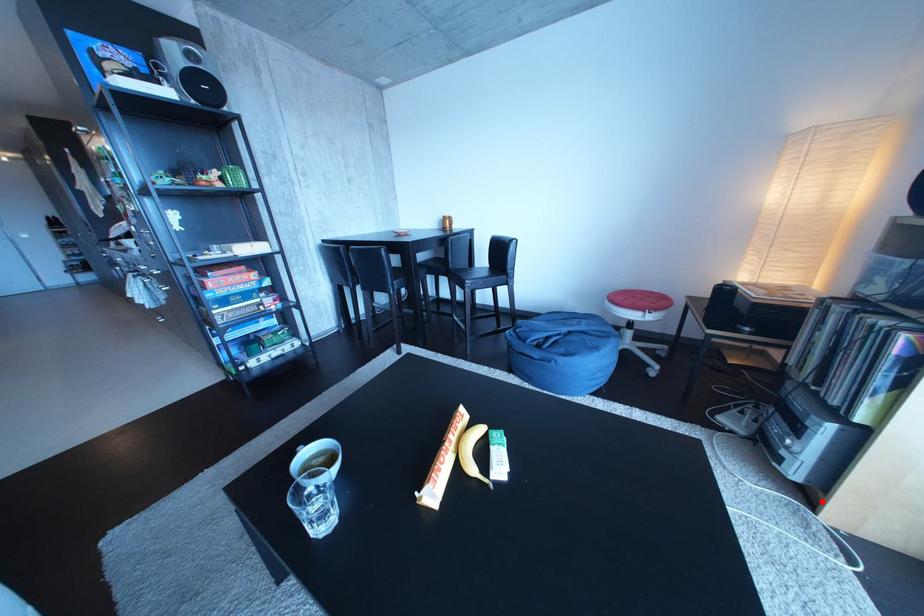
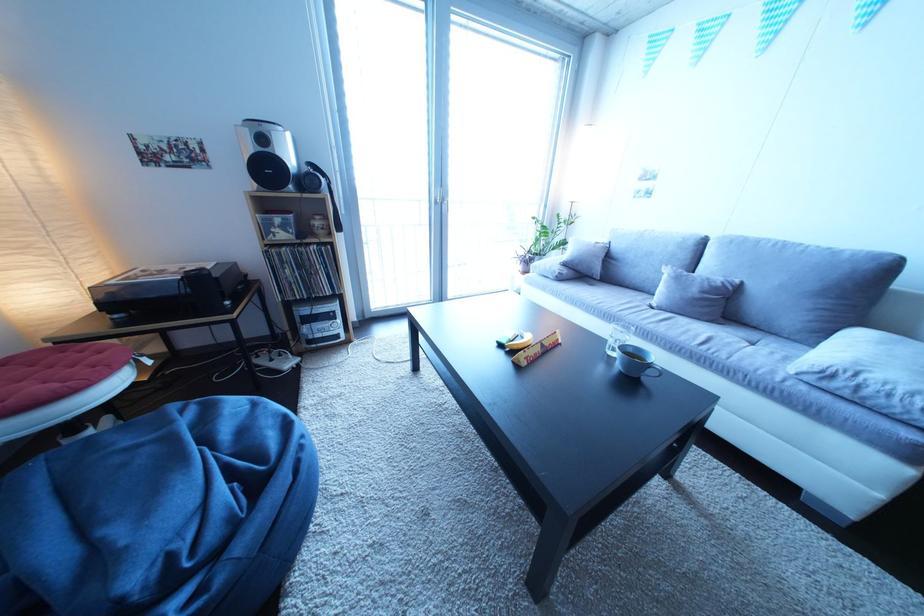
Question: I am providing you with two images of the same scene from different viewpoints. A red point is marked on the first image. Is the red point's position out of view in image 2?

Choices:
 (A) Yes
 (B) No

Answer: (A)